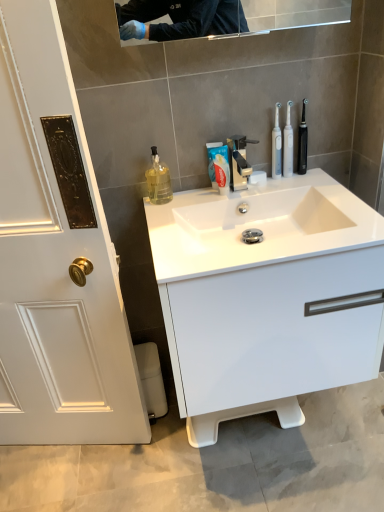
Question: Is polished chrome faucet at center smaller than white glossy sink at center?

Choices:
 (A) no
 (B) yes

Answer: (B)

Question: Is polished chrome faucet at center aimed at white glossy sink at center?

Choices:
 (A) no
 (B) yes

Answer: (B)

Question: Considering the relative sizes of polished chrome faucet at center and white glossy sink at center in the image provided, is polished chrome faucet at center wider than white glossy sink at center?

Choices:
 (A) yes
 (B) no

Answer: (B)

Question: Does polished chrome faucet at center have a larger size compared to white glossy sink at center?

Choices:
 (A) yes
 (B) no

Answer: (B)

Question: Can you confirm if polished chrome faucet at center is positioned to the right of white glossy sink at center?

Choices:
 (A) no
 (B) yes

Answer: (A)

Question: Considering their positions, is black plastic toothbrush at right, the 2th toothbrush positioned from the left, located in front of or behind white glossy cabinet at center?

Choices:
 (A) behind
 (B) front

Answer: (A)

Question: In terms of width, does black plastic toothbrush at right, the 2th toothbrush positioned from the left, look wider or thinner when compared to white glossy cabinet at center?

Choices:
 (A) wide
 (B) thin

Answer: (B)

Question: Is black plastic toothbrush at right, the 2th toothbrush positioned from the left, bigger or smaller than white glossy cabinet at center?

Choices:
 (A) big
 (B) small

Answer: (B)

Question: Visually, is black plastic toothbrush at right, which appears as the 1th toothbrush when viewed from the right, positioned to the left or to the right of white glossy cabinet at center?

Choices:
 (A) left
 (B) right

Answer: (B)

Question: Visually, is black plastic toothbrush at right, the 2th toothbrush positioned from the left, positioned to the left or to the right of white glossy toothpaste at center?

Choices:
 (A) right
 (B) left

Answer: (A)

Question: Considering the positions of point (299, 164) and point (216, 181), is point (299, 164) closer or farther from the camera than point (216, 181)?

Choices:
 (A) farther
 (B) closer

Answer: (A)

Question: From a real-world perspective, is black plastic toothbrush at right, which appears as the 1th toothbrush when viewed from the right, positioned above or below white glossy toothpaste at center?

Choices:
 (A) below
 (B) above

Answer: (B)

Question: Is black plastic toothbrush at right, which appears as the 1th toothbrush when viewed from the right, in front of or behind white glossy toothpaste at center in the image?

Choices:
 (A) behind
 (B) front

Answer: (A)

Question: Is point (244, 153) positioned closer to the camera than point (205, 270)?

Choices:
 (A) farther
 (B) closer

Answer: (A)

Question: From their relative heights in the image, would you say polished chrome faucet at center is taller or shorter than white glossy sink at center?

Choices:
 (A) short
 (B) tall

Answer: (B)